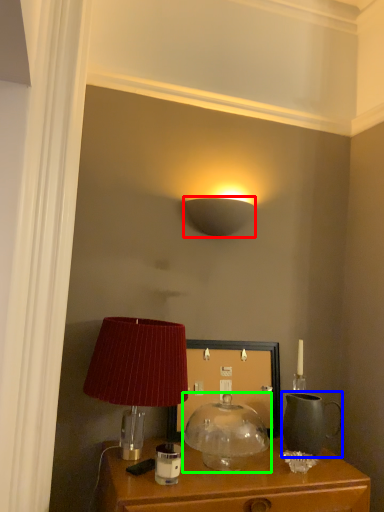
Question: Estimate the real-world distances between objects in this image. Which object is farther from lamp (highlighted by a red box), tea pot (highlighted by a blue box) or lamp (highlighted by a green box)?

Choices:
 (A) tea pot
 (B) lamp

Answer: (A)